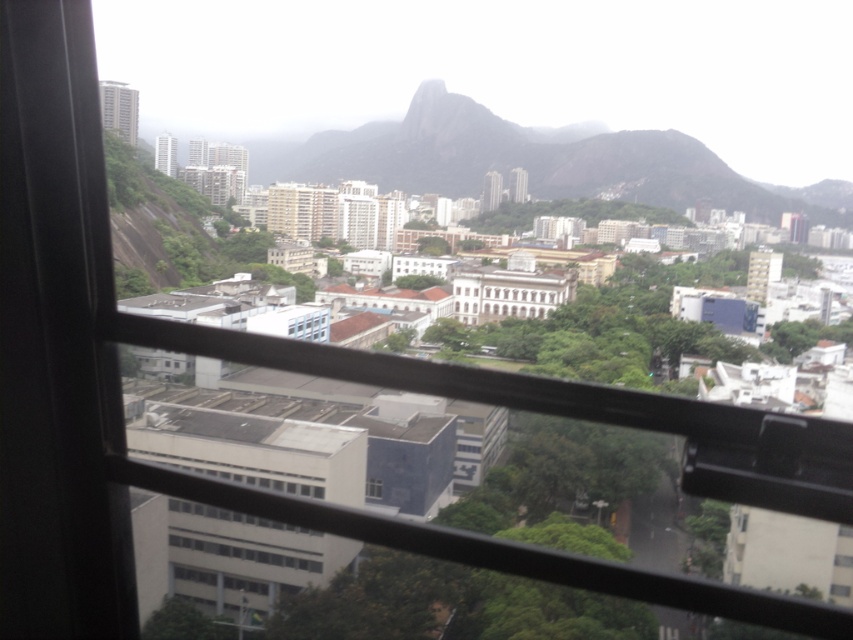
You are standing in a room and notice two windows in front of you. The first is the transparent plastic window at center, and the second is the transparent glass window at center. Which window is positioned more to the left side of your view?

The transparent plastic window at center is positioned more to the left side of your view because it is to the left of the transparent glass window at center.

You are a delivery drone that needs to fly through the space between the transparent plastic window at center and the transparent glass window at center. Your drone has a wingspan of 1 meter. Can you safely pass through this gap without touching either window?

The distance between the transparent plastic window at center and the transparent glass window at center is 101.19 meters. Since the gap is significantly wider than the drone wingspan of 1 meter, the drone can safely pass through without touching either window.

You are an architect designing a new building and want to ensure that the transparent plastic window at center and the transparent glass window at center provide optimal visibility. Since both windows are at the center, which one would you adjust to allow more light through without obstructing the view of the mountain in the background?

The transparent plastic window at center is positioned over the transparent glass window at center. To allow more light through without obstructing the view of the mountain, you should adjust the transparent plastic window at center to be removed or made more transparent, as it is layered over the glass window and might be causing some obstruction.